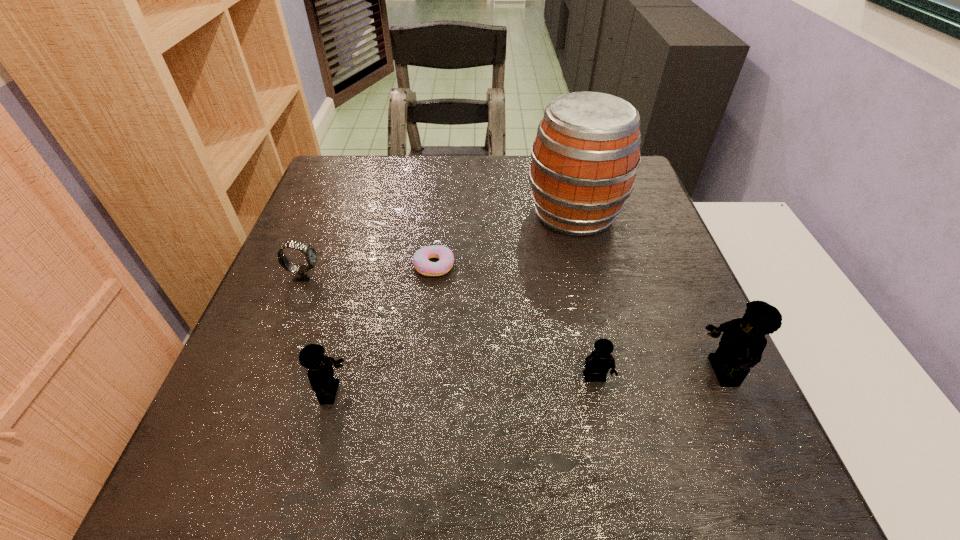
Please point a space for a new Lego to maintain equal intervals. Please provide its 2D coordinates. Your answer should be formatted as a tuple, i.e. [(x, y)], where the tuple contains the x and y coordinates of a point satisfying the conditions above.

[(465, 386)]